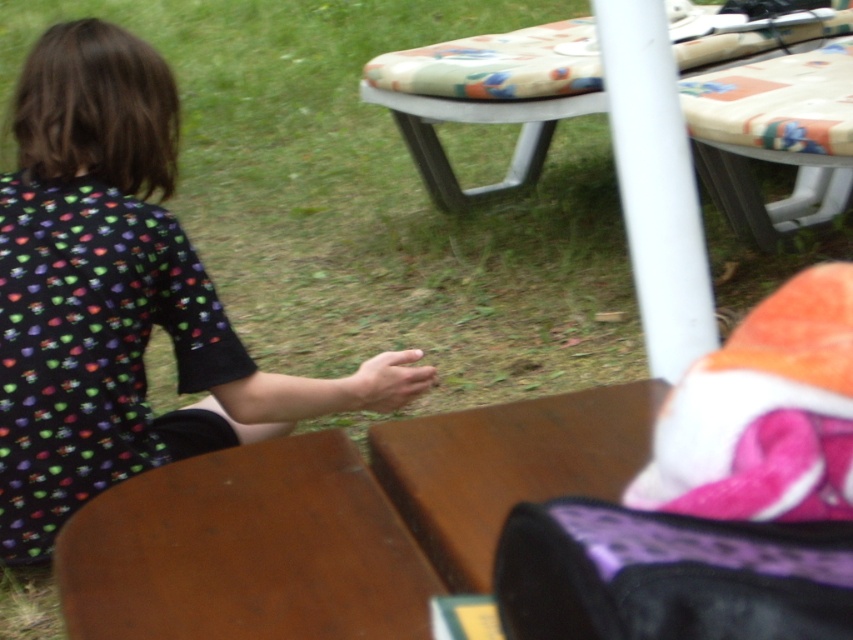
Question: Can you confirm if brown wooden table at center is positioned to the left of patterned fabric table at upper center?

Choices:
 (A) no
 (B) yes

Answer: (B)

Question: Among these objects, which one is nearest to the camera?

Choices:
 (A) brown wooden table at lower left
 (B) patterned fabric table at upper center
 (C) printed fabric shirt at left
 (D) brown wooden table at center

Answer: (A)

Question: Does brown wooden table at lower left have a lesser width compared to brown wooden table at center?

Choices:
 (A) no
 (B) yes

Answer: (A)

Question: Is patterned fabric table at upper center closer to the viewer compared to smooth skin hand at center?

Choices:
 (A) no
 (B) yes

Answer: (A)

Question: Which point is closer to the camera?

Choices:
 (A) printed fabric shirt at left
 (B) patterned fabric table at upper center
 (C) brown wooden table at center

Answer: (C)

Question: Among these objects, which one is nearest to the camera?

Choices:
 (A) brown wooden table at lower left
 (B) brown wooden table at center
 (C) patterned fabric table at upper center

Answer: (A)